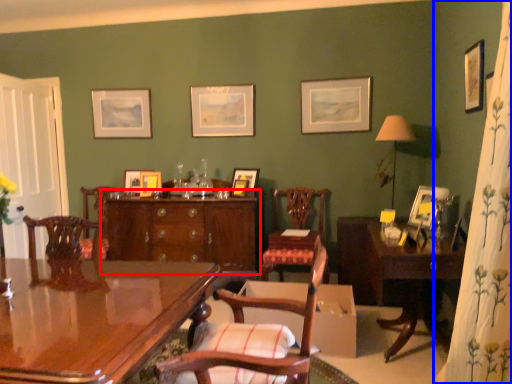
Question: Which object appears closest to the camera in this image, cabinetry (highlighted by a red box) or curtain (highlighted by a blue box)?

Choices:
 (A) cabinetry
 (B) curtain

Answer: (B)